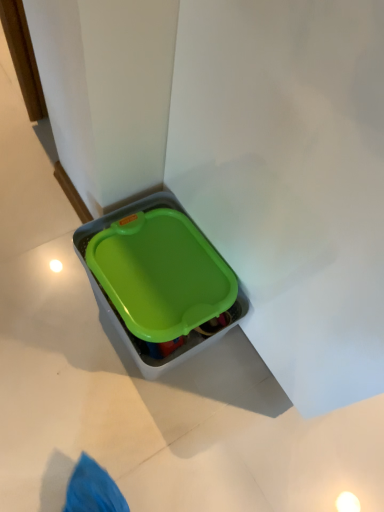
You are a GUI agent. You are given a task and a screenshot of the screen. Output one action in this format:
    pyautogui.click(x=<x>, y=<y>)
    Task: Click on the spots to the right of green plastic container at lower left
    The height and width of the screenshot is (512, 384).
    Given the screenshot: What is the action you would take?
    pyautogui.click(x=233, y=382)